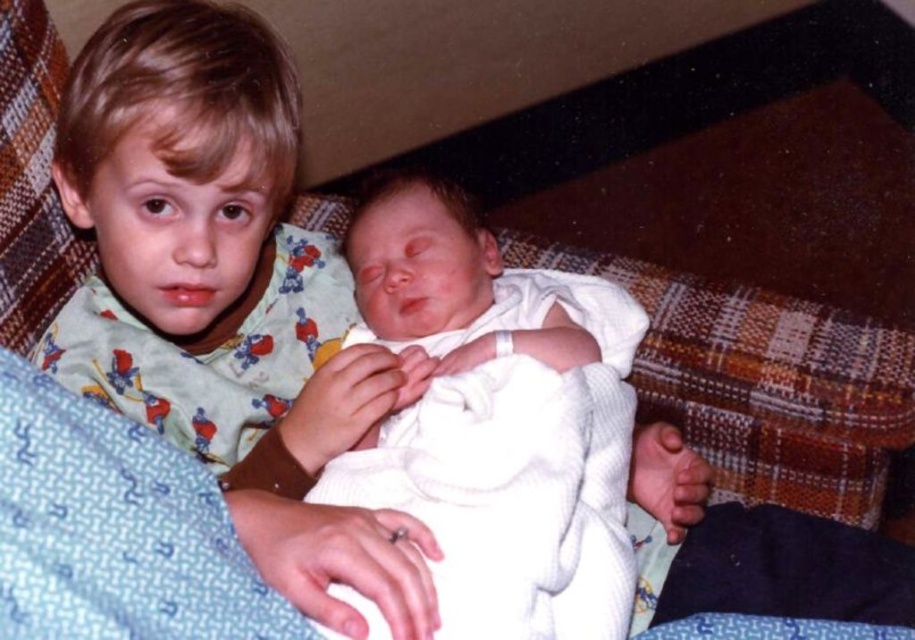
Question: Can you confirm if light green pajamas at upper left is positioned above white knit baby at center?

Choices:
 (A) yes
 (B) no

Answer: (A)

Question: Can you confirm if light green pajamas at upper left is positioned to the right of white knit baby at center?

Choices:
 (A) no
 (B) yes

Answer: (A)

Question: Can you confirm if light green pajamas at upper left is thinner than white knit baby at center?

Choices:
 (A) no
 (B) yes

Answer: (B)